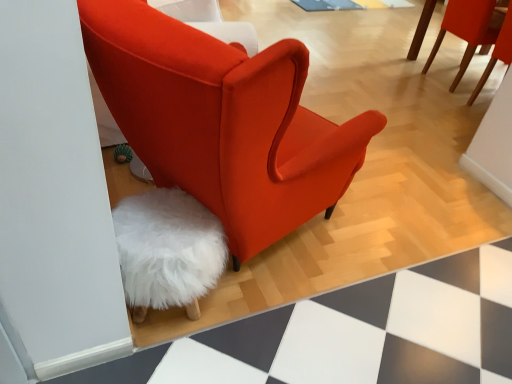
Question: Considering the relative positions of white fluffy stool at lower left and velvet orange chair at center, which is the 2th chair from back to front, in the image provided, is white fluffy stool at lower left in front of velvet orange chair at center, which is the 2th chair from back to front,?

Choices:
 (A) no
 (B) yes

Answer: (A)

Question: Is white fluffy stool at lower left smaller than velvet orange chair at center, marked as the 2th chair in a right-to-left arrangement?

Choices:
 (A) yes
 (B) no

Answer: (A)

Question: Does white fluffy stool at lower left have a lesser width compared to velvet orange chair at center, which is the 2th chair from back to front?

Choices:
 (A) no
 (B) yes

Answer: (B)

Question: Considering the relative sizes of white fluffy stool at lower left and velvet orange chair at center, which is the 2th chair from back to front, in the image provided, is white fluffy stool at lower left wider than velvet orange chair at center, which is the 2th chair from back to front,?

Choices:
 (A) no
 (B) yes

Answer: (A)

Question: Does white fluffy stool at lower left appear on the right side of velvet orange chair at center, marked as the 2th chair in a right-to-left arrangement?

Choices:
 (A) yes
 (B) no

Answer: (B)

Question: Does white fluffy stool at lower left lie behind velvet orange chair at center, which appears as the first chair when viewed from the left?

Choices:
 (A) no
 (B) yes

Answer: (B)

Question: From the image's perspective, would you say matte red chair at upper right, which is counted as the second chair, starting from the bottom, is shown under white fluffy stool at lower left?

Choices:
 (A) no
 (B) yes

Answer: (A)

Question: Is matte red chair at upper right, the first chair in the top-to-bottom sequence, wider than white fluffy stool at lower left?

Choices:
 (A) yes
 (B) no

Answer: (A)

Question: Is the surface of matte red chair at upper right, arranged as the first chair when viewed from the right, in direct contact with white fluffy stool at lower left?

Choices:
 (A) no
 (B) yes

Answer: (A)

Question: Is matte red chair at upper right, the first chair in the top-to-bottom sequence, not inside white fluffy stool at lower left?

Choices:
 (A) no
 (B) yes

Answer: (B)

Question: Would you say matte red chair at upper right, which is counted as the second chair, starting from the bottom, contains white fluffy stool at lower left?

Choices:
 (A) no
 (B) yes

Answer: (A)

Question: Does matte red chair at upper right, positioned as the second chair in front-to-back order, have a lesser width compared to white fluffy stool at lower left?

Choices:
 (A) yes
 (B) no

Answer: (B)

Question: Considering the relative sizes of velvet orange chair at center, placed as the first chair when sorted from bottom to top, and matte red chair at upper right, the first chair in the top-to-bottom sequence, in the image provided, is velvet orange chair at center, placed as the first chair when sorted from bottom to top, bigger than matte red chair at upper right, the first chair in the top-to-bottom sequence,?

Choices:
 (A) no
 (B) yes

Answer: (B)